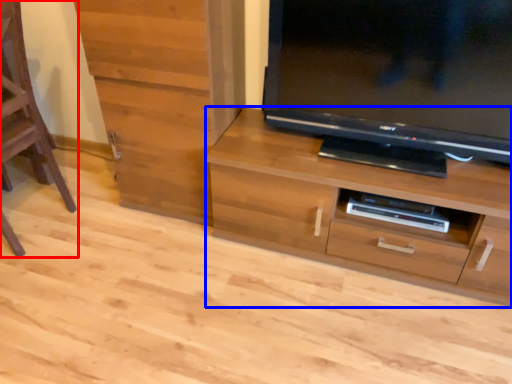
Question: Which object is further to the camera taking this photo, furniture (highlighted by a red box) or chest of drawers (highlighted by a blue box)?

Choices:
 (A) furniture
 (B) chest of drawers

Answer: (B)